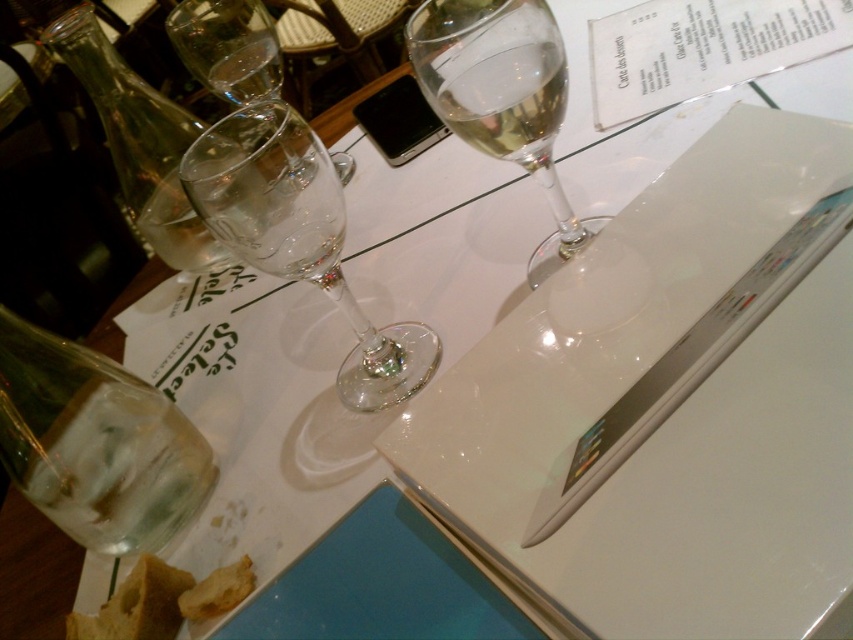
You are a server at a restaurant and need to place a new drink order on the table. There are two clear glasses on the table. Which one is more to the left between the clear glass wine glass at upper left and the clear glass at upper center?

The clear glass at upper center is more to the left because the clear glass wine glass at upper left is positioned on the right side of it.

You are a photographer adjusting your camera settings to focus on two points on the table. The first point is at coordinates point (453, 90) and the second is at point (520, 124). Which point should you focus on first to ensure the closest object is in sharp focus?

Point (453, 90) is closer to the camera than point (520, 124), so you should focus on point (453, 90) first to ensure the closest object is in sharp focus.

You are a server at a restaurant and need to place a new drink order on the table. The table has a transparent glass bottle at left and a clear glass wine at upper center. Which object has a larger width, and can you place the new drink between them without moving the existing items?

The transparent glass bottle at left has a larger width than the clear glass wine at upper center. However, since the description only provides information about their widths and not the distance between them, it is uncertain if there is enough space to place the new drink between them without moving existing items.